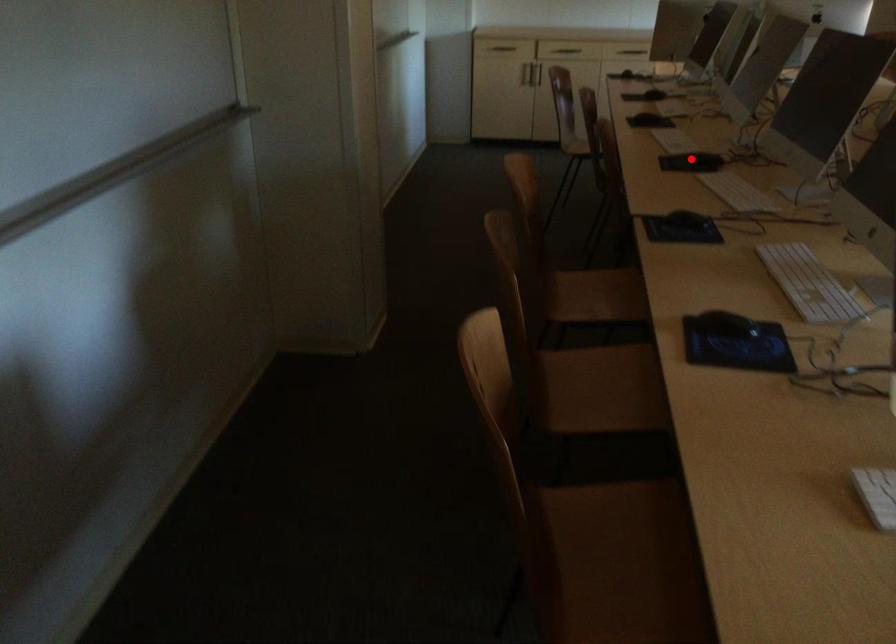
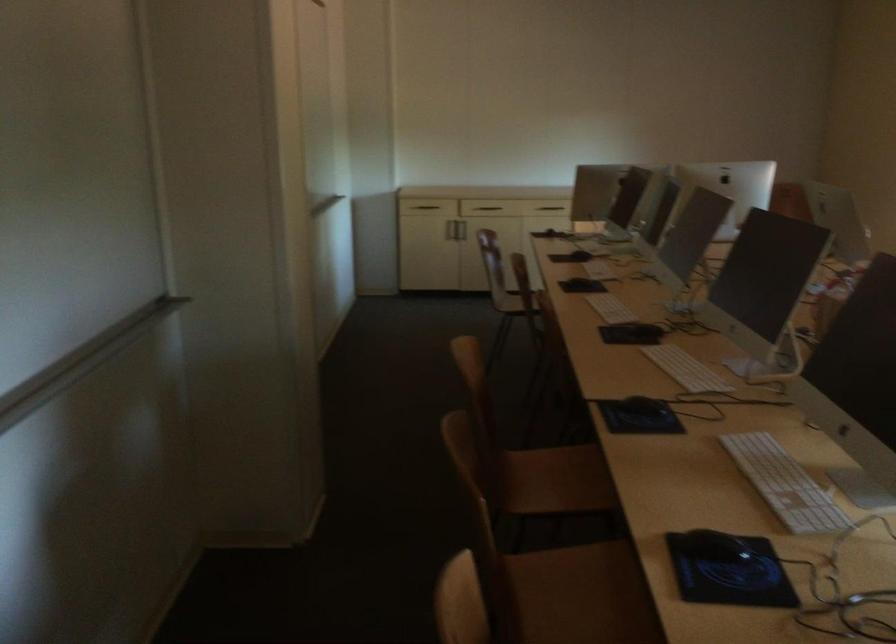
In the second image, find the point that corresponds to the highlighted location in the first image.

(631, 330)